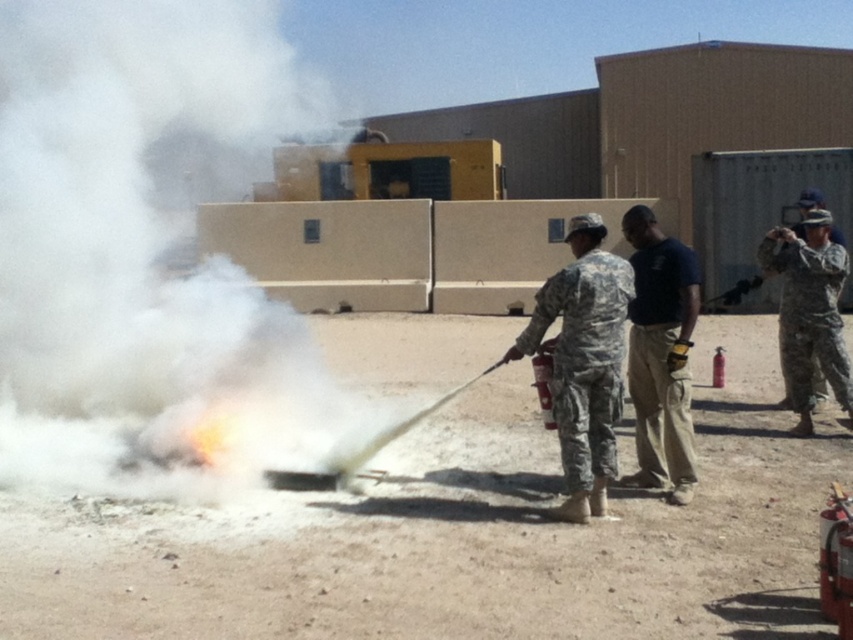
You are a drone operator assigned to monitor the fire suppression exercise. You need to fly your drone to the two points marked in the scene. Which point, point (581, 353) or point (659, 273), is closer to you as you operate the drone from your current position?

Point (581, 353) is closer to the viewer than point (659, 273), so the drone should fly to point (581, 353) first as it is nearer.